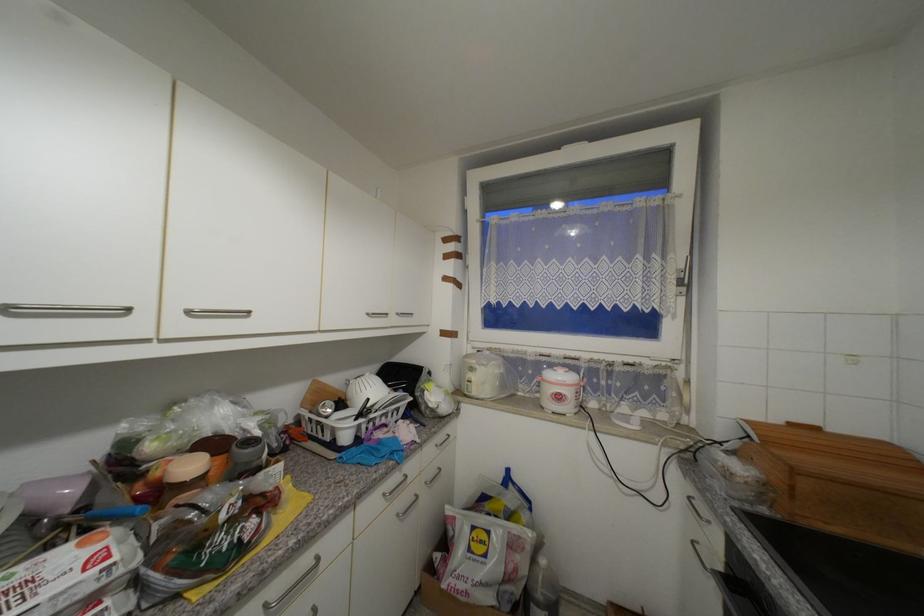
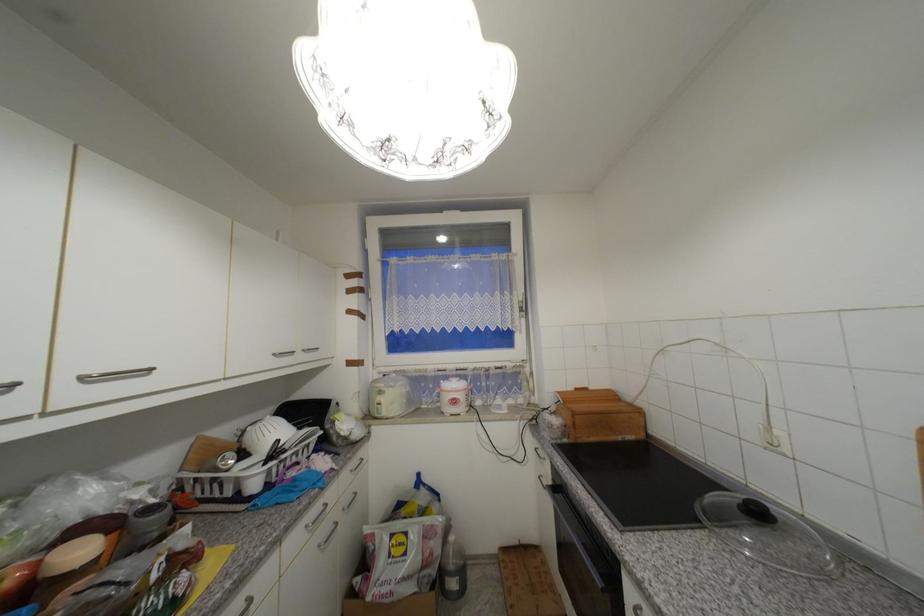
Locate, in the second image, the point that corresponds to pixel 441 435 in the first image.

(357, 460)